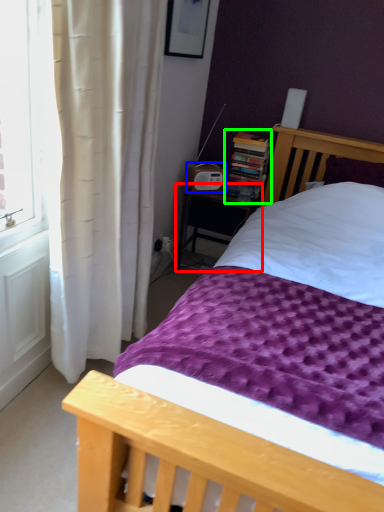
Question: Which is farther away from nightstand (highlighted by a red box)? radio (highlighted by a blue box) or book (highlighted by a green box)?

Choices:
 (A) radio
 (B) book

Answer: (B)